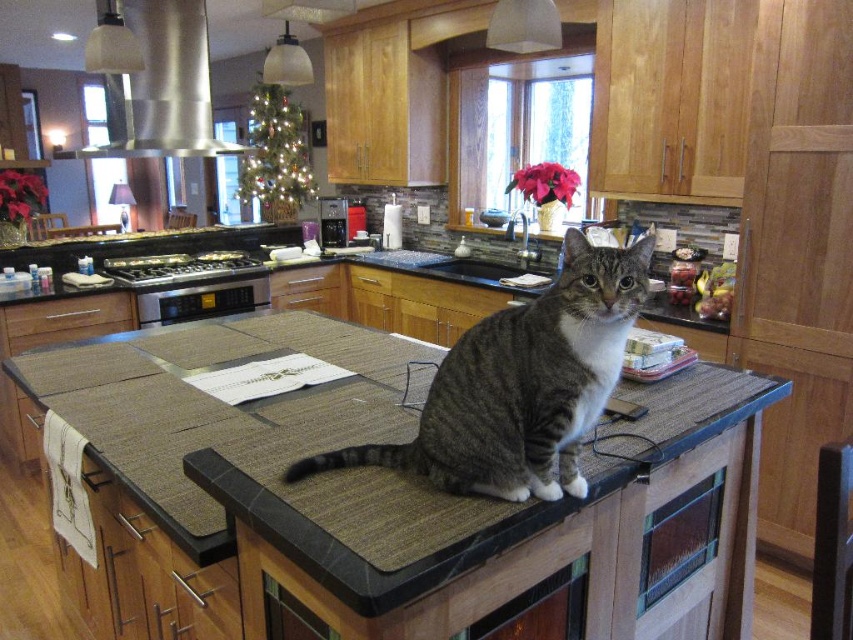
Question: Which of the following is the farthest from the observer?

Choices:
 (A) (569, 289)
 (B) (96, 42)

Answer: (B)

Question: Which object appears farthest from the camera in this image?

Choices:
 (A) satin silver exhaust hood at upper left
 (B) gray striped cat at center

Answer: (A)

Question: Is gray striped cat at center to the left of satin silver exhaust hood at upper left from the viewer's perspective?

Choices:
 (A) yes
 (B) no

Answer: (B)

Question: Which of the following is the farthest from the observer?

Choices:
 (A) (512, 369)
 (B) (157, 3)

Answer: (B)

Question: Does gray striped cat at center have a smaller size compared to satin silver exhaust hood at upper left?

Choices:
 (A) yes
 (B) no

Answer: (A)

Question: Does gray striped cat at center have a lesser width compared to satin silver exhaust hood at upper left?

Choices:
 (A) yes
 (B) no

Answer: (A)